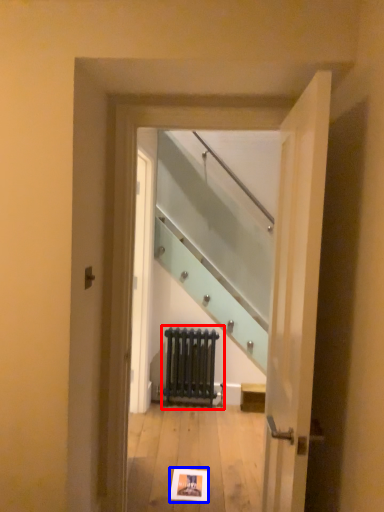
Question: Among these objects, which one is nearest to the camera, radiator (highlighted by a red box) or postcard (highlighted by a blue box)?

Choices:
 (A) radiator
 (B) postcard

Answer: (B)